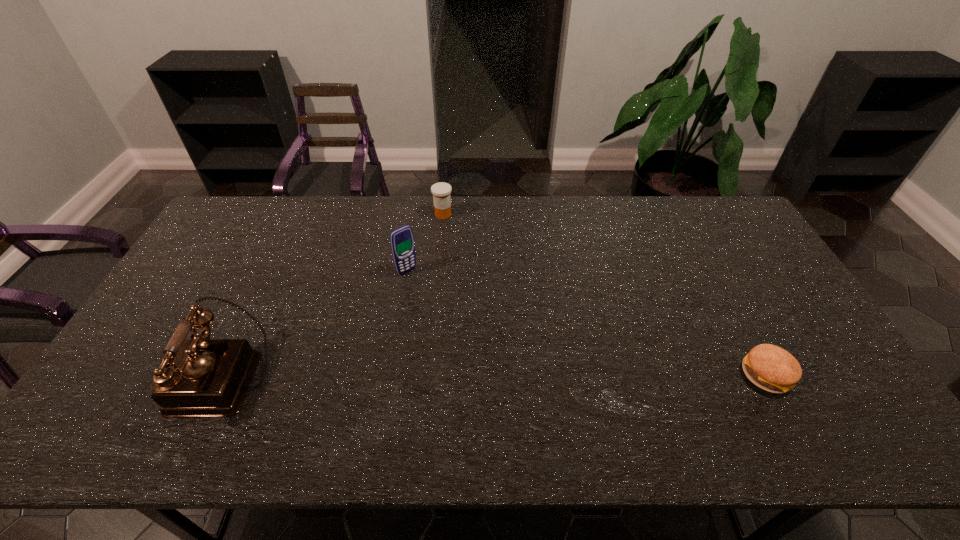
Image resolution: width=960 pixels, height=540 pixels. I want to click on vacant space on the desktop that is between the tallest object and the hamburger and is positioned on the label of the second object from right to left, so click(555, 376).

Image resolution: width=960 pixels, height=540 pixels. I want to click on vacant spot on the desktop that is between the telephone and the rightmost object and is positioned on the front-facing side of the cellular telephone, so click(512, 376).